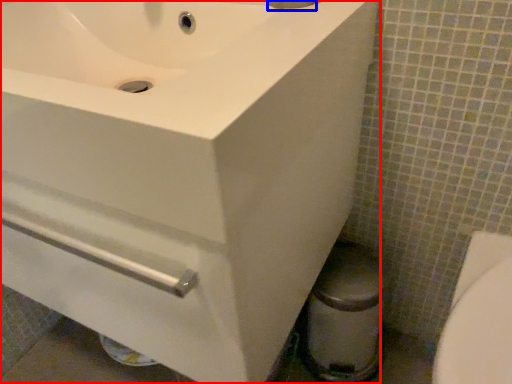
Question: Which point is further to the camera, sink (highlighted by a red box) or plumbing fixture (highlighted by a blue box)?

Choices:
 (A) sink
 (B) plumbing fixture

Answer: (B)